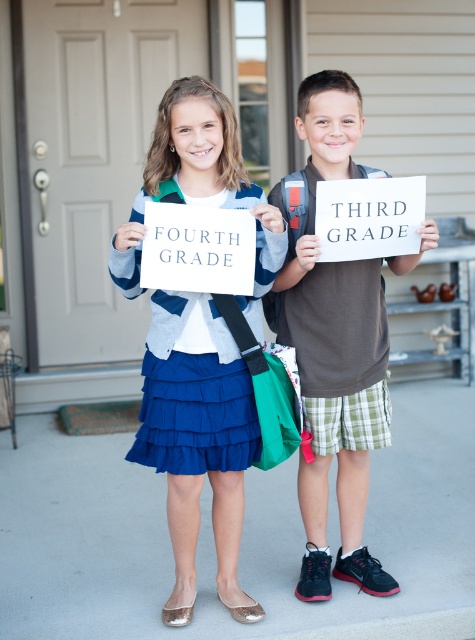
Question: Which of the following is the closest to the observer?

Choices:
 (A) brown cotton shirt at center
 (B) blue fabric skirt at center

Answer: (B)

Question: Can you confirm if blue fabric skirt at center is positioned above brown cotton shirt at center?

Choices:
 (A) yes
 (B) no

Answer: (B)

Question: Can you confirm if blue fabric skirt at center is smaller than brown cotton shirt at center?

Choices:
 (A) no
 (B) yes

Answer: (B)

Question: Can you confirm if blue fabric skirt at center is positioned to the right of brown cotton shirt at center?

Choices:
 (A) yes
 (B) no

Answer: (B)

Question: Which point appears farthest from the camera in this image?

Choices:
 (A) (348, 515)
 (B) (181, 364)

Answer: (A)